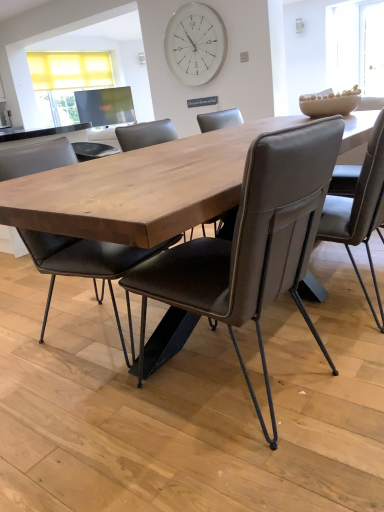
Question: From the image's perspective, would you say white glass clock at upper center is positioned over brown leather chair at center, marked as the second chair in a left-to-right arrangement?

Choices:
 (A) no
 (B) yes

Answer: (B)

Question: Are white glass clock at upper center and brown leather chair at center, marked as the second chair in a left-to-right arrangement, making contact?

Choices:
 (A) yes
 (B) no

Answer: (B)

Question: Can you confirm if white glass clock at upper center is smaller than brown leather chair at center, which is the 2th chair from right to left?

Choices:
 (A) no
 (B) yes

Answer: (B)

Question: Is the position of white glass clock at upper center more distant than that of brown leather chair at center, marked as the second chair in a left-to-right arrangement?

Choices:
 (A) yes
 (B) no

Answer: (A)

Question: Can you confirm if white glass clock at upper center is thinner than brown leather chair at center, marked as the second chair in a left-to-right arrangement?

Choices:
 (A) yes
 (B) no

Answer: (A)

Question: Which is correct: leather-like chair at center, placed as the 3th chair when sorted from left to right, is inside brown leather chair at center, marked as the second chair in a left-to-right arrangement, or outside of it?

Choices:
 (A) outside
 (B) inside

Answer: (A)

Question: In terms of width, does leather-like chair at center, placed as the 3th chair when sorted from left to right, look wider or thinner when compared to brown leather chair at center, which is the 2th chair from right to left?

Choices:
 (A) wide
 (B) thin

Answer: (B)

Question: Considering their positions, is leather-like chair at center, arranged as the first chair when viewed from the right, located in front of or behind brown leather chair at center, marked as the second chair in a left-to-right arrangement?

Choices:
 (A) behind
 (B) front

Answer: (A)

Question: From a real-world perspective, is leather-like chair at center, arranged as the first chair when viewed from the right, above or below brown leather chair at center, marked as the second chair in a left-to-right arrangement?

Choices:
 (A) below
 (B) above

Answer: (B)

Question: Is white glass clock at upper center bigger or smaller than matte black chair at center, acting as the third chair starting from the right?

Choices:
 (A) big
 (B) small

Answer: (B)

Question: Looking at their shapes, would you say white glass clock at upper center is wider or thinner than matte black chair at center, acting as the third chair starting from the right?

Choices:
 (A) thin
 (B) wide

Answer: (A)

Question: From a real-world perspective, is white glass clock at upper center above or below matte black chair at center, acting as the third chair starting from the right?

Choices:
 (A) above
 (B) below

Answer: (A)

Question: Does point (195, 76) appear closer or farther from the camera than point (39, 232)?

Choices:
 (A) closer
 (B) farther

Answer: (B)

Question: Which is correct: leather-like chair at center, arranged as the first chair when viewed from the right, is inside matte black chair at center, acting as the third chair starting from the right, or outside of it?

Choices:
 (A) inside
 (B) outside

Answer: (B)

Question: Visually, is leather-like chair at center, arranged as the first chair when viewed from the right, positioned to the left or to the right of matte black chair at center, acting as the third chair starting from the right?

Choices:
 (A) left
 (B) right

Answer: (B)